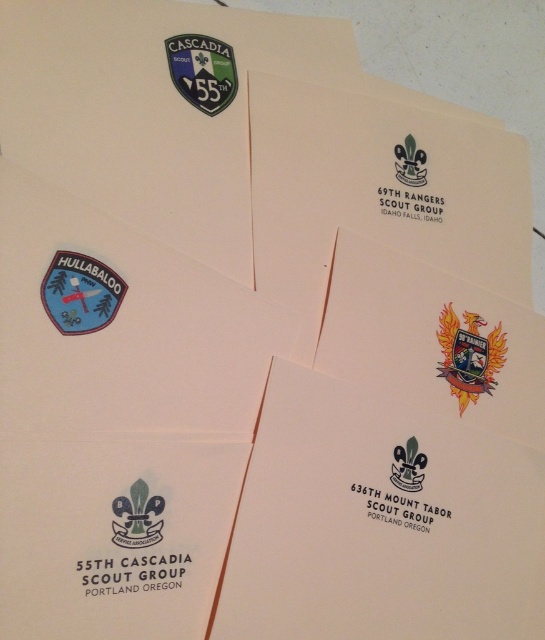
Looking at the arrangement of the green matte patch at upper left and the green matte logo at lower left, which one is positioned higher in the image?

The green matte patch at upper left is positioned higher than the green matte logo at lower left.

You are organizing a scouting event and need to arrange these patches on a display board. The board has a height limit of 10 cm. You have a green matte patch at upper left and a green matte logo at lower left. Which one will exceed the height limit if placed as is?

The green matte patch at upper left is much taller than the green matte logo at lower left. If the board has a height limit of 10 cm, the green matte patch at upper left may exceed the limit, while the green matte logo at lower left would likely fit within the 10 cm constraint.